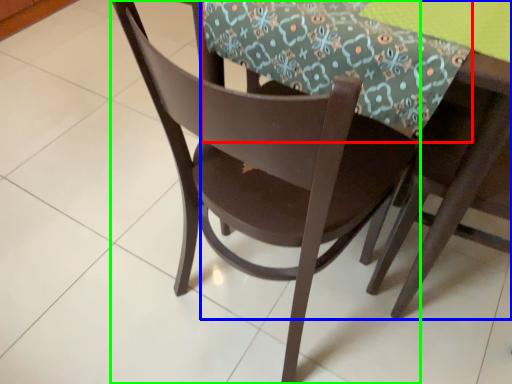
Question: Estimate the real-world distances between objects in this image. Which object is closer to tablecloth (highlighted by a red box), round table (highlighted by a blue box) or chair (highlighted by a green box)?

Choices:
 (A) round table
 (B) chair

Answer: (A)